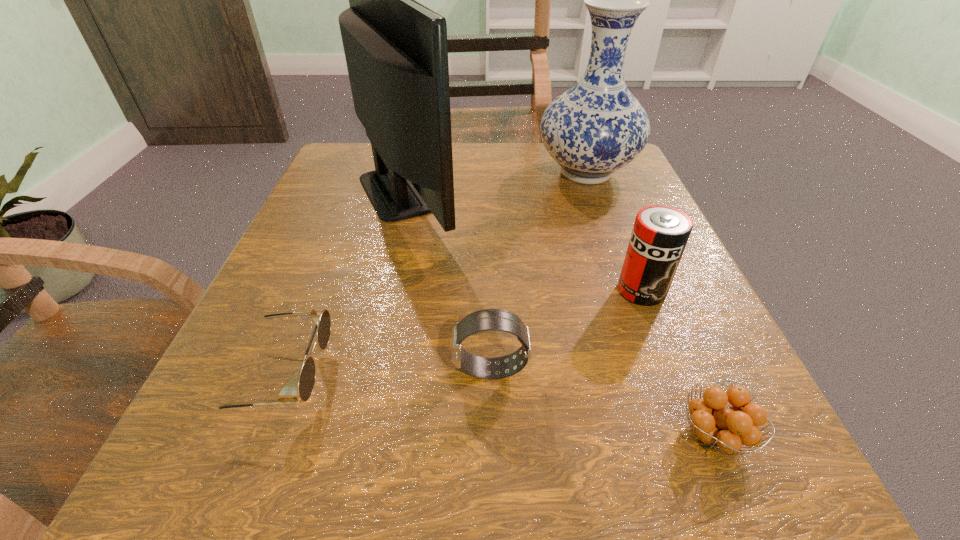
The width and height of the screenshot is (960, 540). Find the location of `sunglasses located in the left edge section of the desktop`. sunglasses located in the left edge section of the desktop is located at coordinates (288, 395).

Image resolution: width=960 pixels, height=540 pixels. I want to click on vase located in the right edge section of the desktop, so click(x=597, y=127).

Find the location of a particular element. can located in the right edge section of the desktop is located at coordinates (660, 233).

Find the location of a particular element. The height and width of the screenshot is (540, 960). orange fruit at the right edge is located at coordinates (726, 428).

The width and height of the screenshot is (960, 540). Identify the location of object located at the far left corner. (396, 50).

Where is `object present at the far right corner`? The width and height of the screenshot is (960, 540). object present at the far right corner is located at coordinates tap(597, 127).

Locate an element on the screen. Image resolution: width=960 pixels, height=540 pixels. object that is at the near right corner is located at coordinates [x=726, y=428].

The width and height of the screenshot is (960, 540). Find the location of `free point at the far edge`. free point at the far edge is located at coordinates (559, 190).

Image resolution: width=960 pixels, height=540 pixels. I want to click on vacant region at the near edge of the desktop, so click(x=346, y=472).

The width and height of the screenshot is (960, 540). I want to click on vacant region at the left edge of the desktop, so click(355, 320).